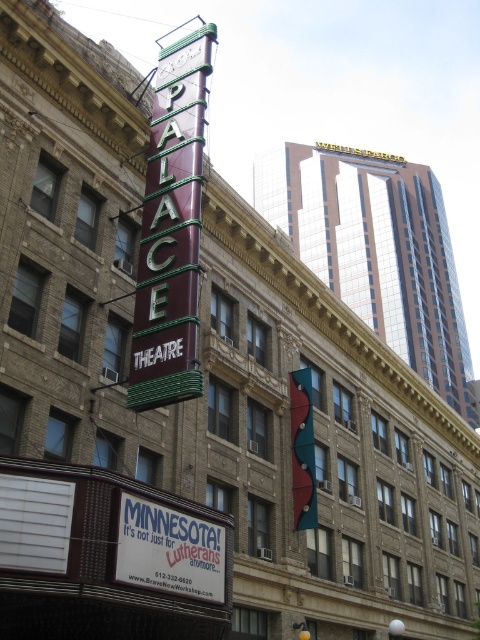
What is located at the point with coordinates [170,230] in the image?

The maroon enamel sign at center left is located at point [170,230].